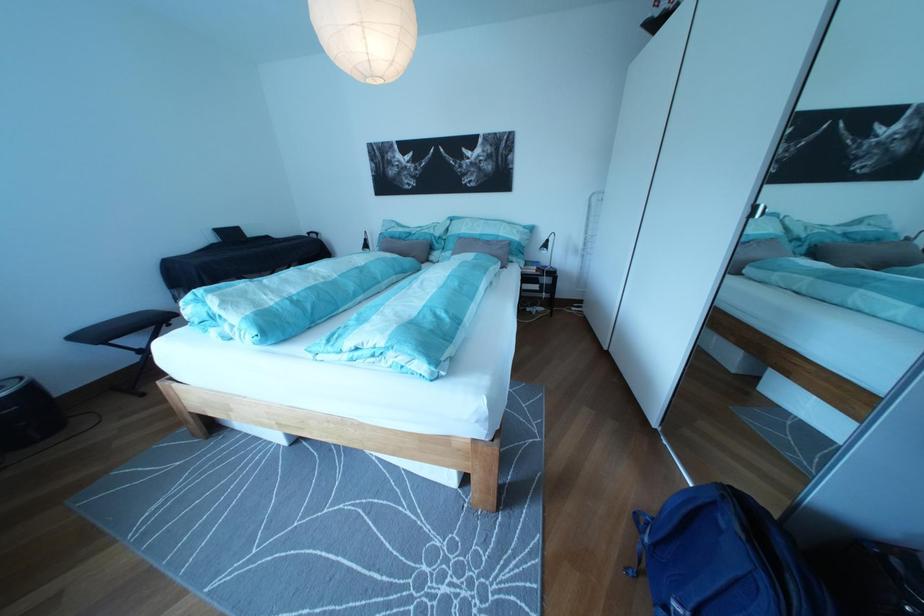
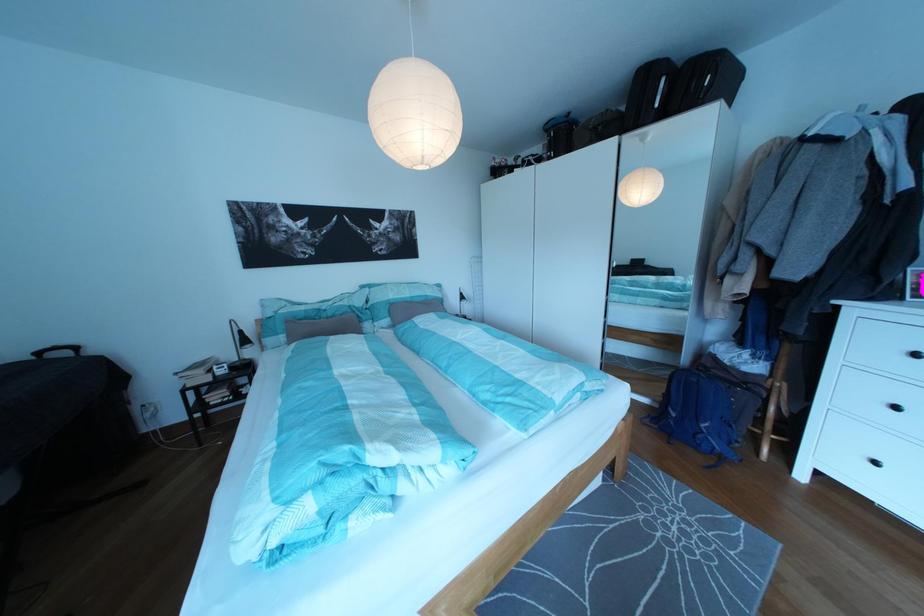
Where in the second image is the point corresponding to point (322, 240) from the first image?

(53, 360)